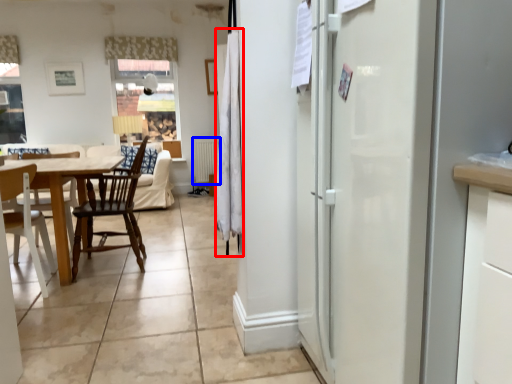
Question: Which object appears farthest to the camera in this image, curtain (highlighted by a red box) or radiator (highlighted by a blue box)?

Choices:
 (A) curtain
 (B) radiator

Answer: (B)